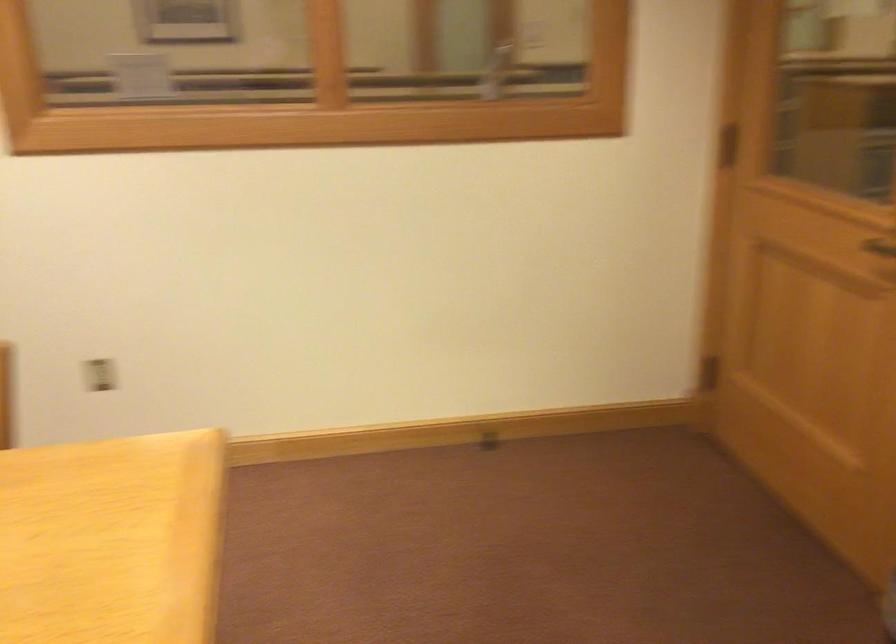
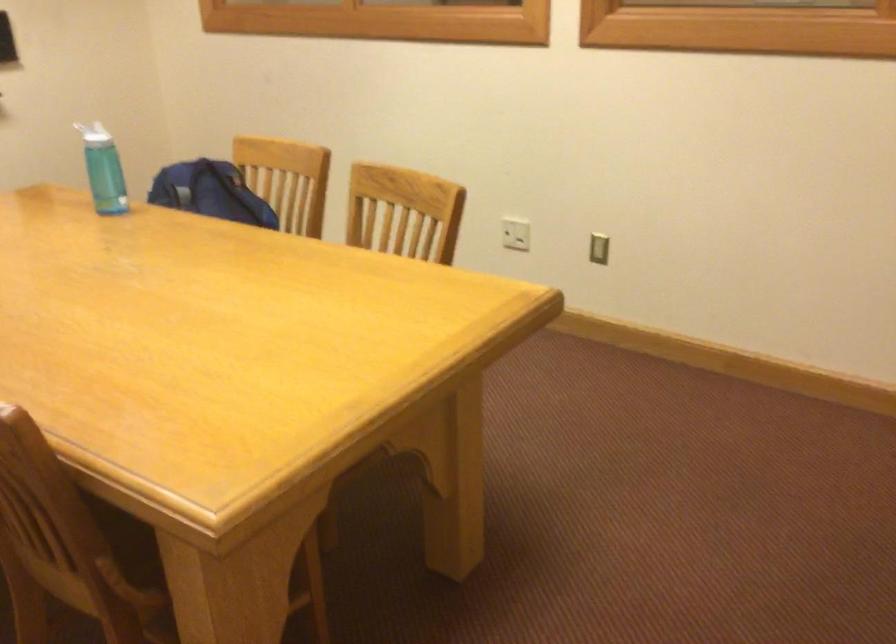
Question: How did the camera likely rotate?

Choices:
 (A) Left
 (B) Right
 (C) Up
 (D) Down

Answer: (A)